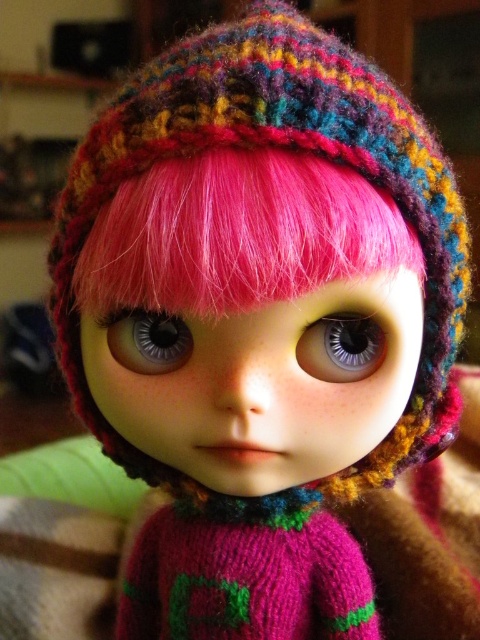
You are a photographer adjusting the focus on your camera. You have two points to focus on in the image of the doll. The first is point (324, 346) and the second is point (142, 339). Which point should you focus on to ensure the doll is in sharp focus?

Point (324, 346) is closer to the viewer than point (142, 339), so focusing on point (324, 346) will ensure the doll is in sharp focus.

You are a toy repair technician examining a doll with two eyes. The doll has a gray matte eye at center and a shiny plastic eye at center. Which eye is positioned lower on the doll?

The gray matte eye at center is positioned below the shiny plastic eye at center, so it is the lower one.

You are a toy repair specialist examining a doll with two eyes. The doll has a gray matte eye at center and a shiny plastic eye at center. Which eye takes up more space on the doll?

The shiny plastic eye at center occupies more space than the gray matte eye at center, so the shiny plastic eye at center takes up more space on the doll.